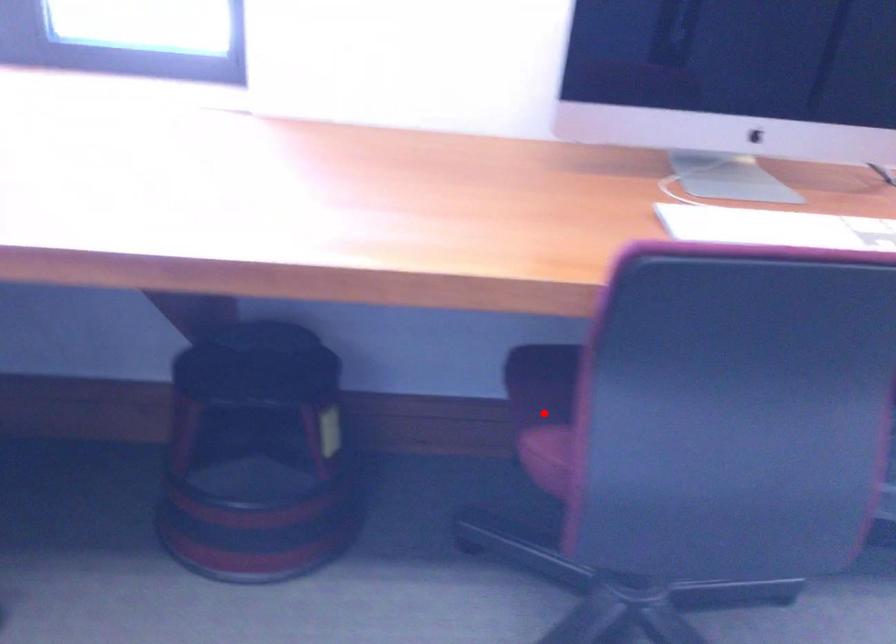
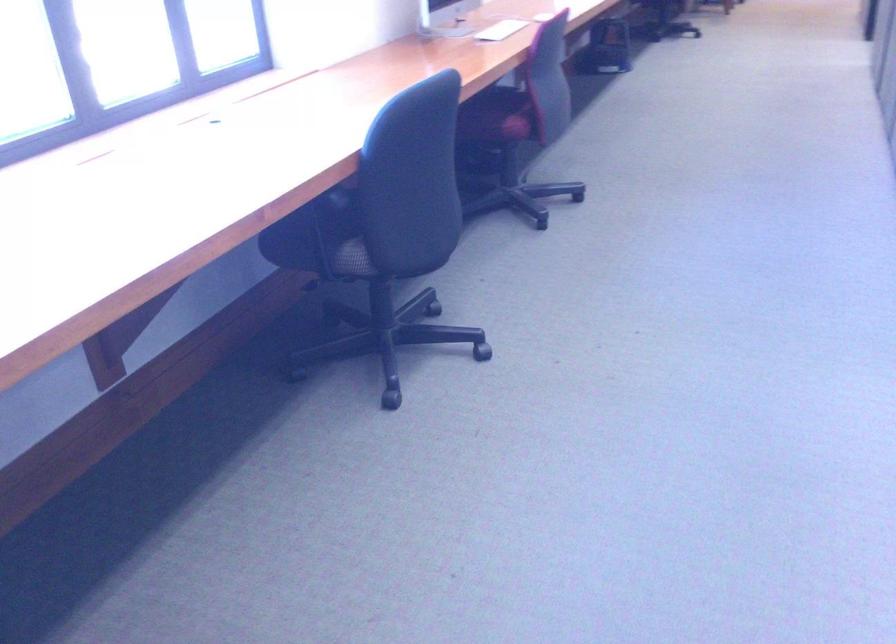
Find the pixel in the second image that matches the highlighted location in the first image.

(497, 116)